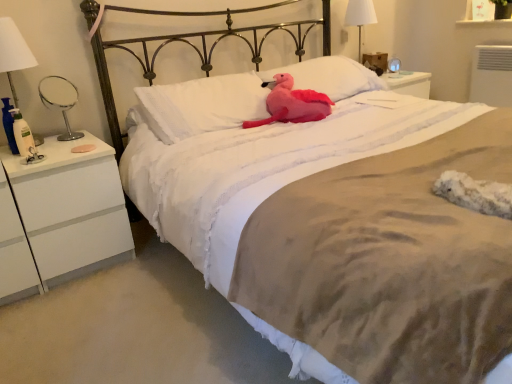
Locate an element on the screen. The image size is (512, 384). fluffy pink plush at center is located at coordinates (292, 103).

What do you see at coordinates (360, 17) in the screenshot?
I see `white fabric lampshade at upper right` at bounding box center [360, 17].

Identify the location of metallic silver mirror at left. The image size is (512, 384). (60, 100).

The width and height of the screenshot is (512, 384). In order to click on fluffy pink plush at center in this screenshot , I will do `click(292, 103)`.

Can you confirm if metallic silver mirror at left is smaller than white fabric lampshade at upper right?

Yes.

Can you confirm if metallic silver mirror at left is thinner than white fabric lampshade at upper right?

Yes.

You are a GUI agent. You are given a task and a screenshot of the screen. Output one action in this format:
    pyautogui.click(x=<x>, y=<y>)
    Task: Click on the bedside lamp above the metallic silver mirror at left (from the image's perspective)
    The image size is (512, 384).
    Given the screenshot: What is the action you would take?
    pyautogui.click(x=360, y=17)

Is point (42, 94) closer to camera compared to point (359, 52)?

Yes, it is.

Does white soft pillow at center, positioned as the first pillow in right-to-left order, come in front of fluffy pink plush at center?

No, the depth of white soft pillow at center, positioned as the first pillow in right-to-left order, is greater than that of fluffy pink plush at center.

Is white soft pillow at center, positioned as the first pillow in right-to-left order, to the left of fluffy pink plush at center from the viewer's perspective?

In fact, white soft pillow at center, positioned as the first pillow in right-to-left order, is to the right of fluffy pink plush at center.

Is white soft pillow at center, positioned as the first pillow in right-to-left order, looking in the opposite direction of fluffy pink plush at center?

No, white soft pillow at center, positioned as the first pillow in right-to-left order, is not facing the opposite direction of fluffy pink plush at center.

Is metallic silver mirror at left in front of or behind white soft pillow at center, acting as the 1th pillow starting from the left, in the image?

In the image, metallic silver mirror at left appears behind white soft pillow at center, acting as the 1th pillow starting from the left.

From a real-world perspective, which object rests below the other?

white soft pillow at center, the second pillow viewed from the right, is physically lower.

Does metallic silver mirror at left touch white soft pillow at center, the second pillow viewed from the right?

No, metallic silver mirror at left is not with white soft pillow at center, the second pillow viewed from the right.

Could you tell me if fluffy pink plush at center is turned towards white soft pillow at center, positioned as the first pillow in right-to-left order?

No, fluffy pink plush at center does not turn towards white soft pillow at center, positioned as the first pillow in right-to-left order.

From the picture: From a real-world perspective, is fluffy pink plush at center above or below white soft pillow at center, which ranks as the 2th pillow in left-to-right order?

fluffy pink plush at center is below white soft pillow at center, which ranks as the 2th pillow in left-to-right order.

From the picture: Is fluffy pink plush at center inside the boundaries of white soft pillow at center, which ranks as the 2th pillow in left-to-right order, or outside?

fluffy pink plush at center is not enclosed by white soft pillow at center, which ranks as the 2th pillow in left-to-right order.

Which is behind, point (311, 120) or point (362, 77)?

Positioned behind is point (362, 77).

Between fluffy pink plush at center and white soft pillow at center, the second pillow viewed from the right, which one is positioned behind?

fluffy pink plush at center is further from the camera.

Which is more to the right, fluffy pink plush at center or white soft pillow at center, the second pillow viewed from the right?

From the viewer's perspective, fluffy pink plush at center appears more on the right side.

Which is further, (x=301, y=89) or (x=190, y=108)?

The point (x=301, y=89) is farther.

Looking at this image, from the image's perspective, is fluffy pink plush at center beneath white soft pillow at center, the second pillow viewed from the right?

Incorrect, from the image's perspective, fluffy pink plush at center is higher than white soft pillow at center, the second pillow viewed from the right.

Can you tell me how much fluffy pink plush at center and white fabric lampshade at upper right differ in facing direction?

9.26 degrees.

Is fluffy pink plush at center positioned far away from white fabric lampshade at upper right?

Yes, fluffy pink plush at center is far from white fabric lampshade at upper right.

From the image's perspective, would you say fluffy pink plush at center is shown under white fabric lampshade at upper right?

Yes.

From a real-world perspective, is fluffy pink plush at center above or below white fabric lampshade at upper right?

Clearly, from a real-world perspective, fluffy pink plush at center is below white fabric lampshade at upper right.

Locate an element on the screen. The image size is (512, 384). nightstand below the white fabric lampshade at upper right (from a real-world perspective) is located at coordinates (70, 206).

Which is more to the right, white fabric lampshade at upper right or white matte/finish nightstand at left?

white fabric lampshade at upper right.

Is white fabric lampshade at upper right not within white matte/finish nightstand at left?

white fabric lampshade at upper right is positioned outside white matte/finish nightstand at left.

Considering the sizes of white fabric lampshade at upper right and white matte/finish nightstand at left in the image, is white fabric lampshade at upper right bigger or smaller than white matte/finish nightstand at left?

Considering their sizes, white fabric lampshade at upper right takes up less space than white matte/finish nightstand at left.

The width and height of the screenshot is (512, 384). Identify the location of bedside lamp behind the metallic silver mirror at left. (360, 17).

Identify the location of pillow lying above the fluffy pink plush at center (from the image's perspective). (330, 76).

Consider the image. When comparing their distances from white matte/finish nightstand at left, does white soft pillow at center, positioned as the first pillow in right-to-left order, or white fabric lampshade at upper right seem further?

white fabric lampshade at upper right is positioned further to the anchor white matte/finish nightstand at left.

Looking at the image, which one is located further to metallic silver mirror at left, white fabric lampshade at upper right or white matte/finish nightstand at left?

white fabric lampshade at upper right lies further to metallic silver mirror at left than the other object.

From the picture: When comparing their distances from white matte/finish nightstand at left, does white soft pillow at center, acting as the 1th pillow starting from the left, or white fabric lampshade at upper right seem further?

Based on the image, white fabric lampshade at upper right appears to be further to white matte/finish nightstand at left.

Estimate the real-world distances between objects in this image. Which object is closer to white matte/finish nightstand at left, fluffy pink plush at center or white soft pillow at center, acting as the 1th pillow starting from the left?

white soft pillow at center, acting as the 1th pillow starting from the left, is positioned closer to the anchor white matte/finish nightstand at left.

Which object lies nearer to the anchor point metallic silver mirror at left, white soft pillow at center, the second pillow viewed from the right, or fluffy pink plush at center?

Based on the image, white soft pillow at center, the second pillow viewed from the right, appears to be nearer to metallic silver mirror at left.

Based on their spatial positions, is white soft pillow at center, the second pillow viewed from the right, or white fabric lampshade at upper right closer to white soft pillow at center, positioned as the first pillow in right-to-left order?

white soft pillow at center, the second pillow viewed from the right, is positioned closer to the anchor white soft pillow at center, positioned as the first pillow in right-to-left order.

Looking at the image, which one is located further to white fabric lampshade at upper right, white soft pillow at center, positioned as the first pillow in right-to-left order, or white soft pillow at center, the second pillow viewed from the right?

Among the two, white soft pillow at center, the second pillow viewed from the right, is located further to white fabric lampshade at upper right.

Estimate the real-world distances between objects in this image. Which object is further from metallic silver mirror at left, white matte/finish nightstand at left or fluffy pink plush at center?

fluffy pink plush at center is further to metallic silver mirror at left.

In order to click on pillow between fluffy pink plush at center and white fabric lampshade at upper right in the front-back direction in this screenshot , I will do `click(330, 76)`.

Identify the location of animal between white matte/finish nightstand at left and white soft pillow at center, which ranks as the 2th pillow in left-to-right order. pos(292,103).

Locate an element on the screen. The width and height of the screenshot is (512, 384). animal between metallic silver mirror at left and white fabric lampshade at upper right is located at coordinates (292, 103).

The image size is (512, 384). I want to click on pillow located between white matte/finish nightstand at left and white soft pillow at center, positioned as the first pillow in right-to-left order, in the left-right direction, so click(202, 105).